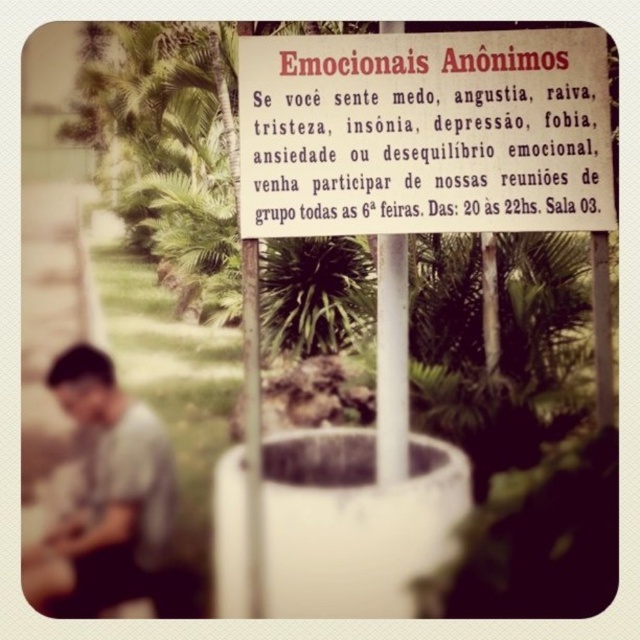
Is white paper sign at center smaller than gray matte shirt at lower left?

Yes.

Who is shorter, white paper sign at center or gray matte shirt at lower left?

white paper sign at center is shorter.

This screenshot has width=640, height=640. What do you see at coordinates (424, 132) in the screenshot?
I see `white paper sign at center` at bounding box center [424, 132].

Identify the location of white paper sign at center. Image resolution: width=640 pixels, height=640 pixels. (424, 132).